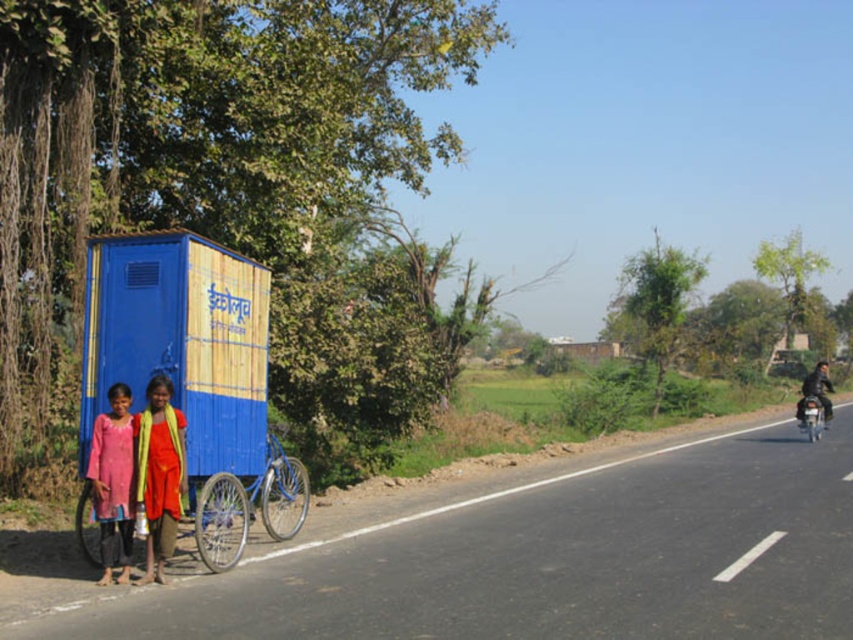
Question: Among these objects, which one is nearest to the camera?

Choices:
 (A) blue matte bicycle at center
 (B) pink cotton dress at lower left

Answer: (B)

Question: Estimate the real-world distances between objects in this image. Which object is closer to the dark blue leather jacket at right?

Choices:
 (A) shiny metallic motorcycle at right
 (B) pink cotton dress at lower left
 (C) pink fabric dress at lower left

Answer: (A)

Question: Is pink cotton dress at lower left to the left of pink fabric dress at lower left from the viewer's perspective?

Choices:
 (A) yes
 (B) no

Answer: (B)

Question: Can you confirm if pink fabric dress at lower left is thinner than shiny metallic motorcycle at right?

Choices:
 (A) yes
 (B) no

Answer: (A)

Question: Observing the image, what is the correct spatial positioning of pink cotton dress at lower left in reference to pink fabric dress at lower left?

Choices:
 (A) below
 (B) above

Answer: (B)

Question: Which of the following is the closest to the observer?

Choices:
 (A) (218, 483)
 (B) (827, 394)

Answer: (A)